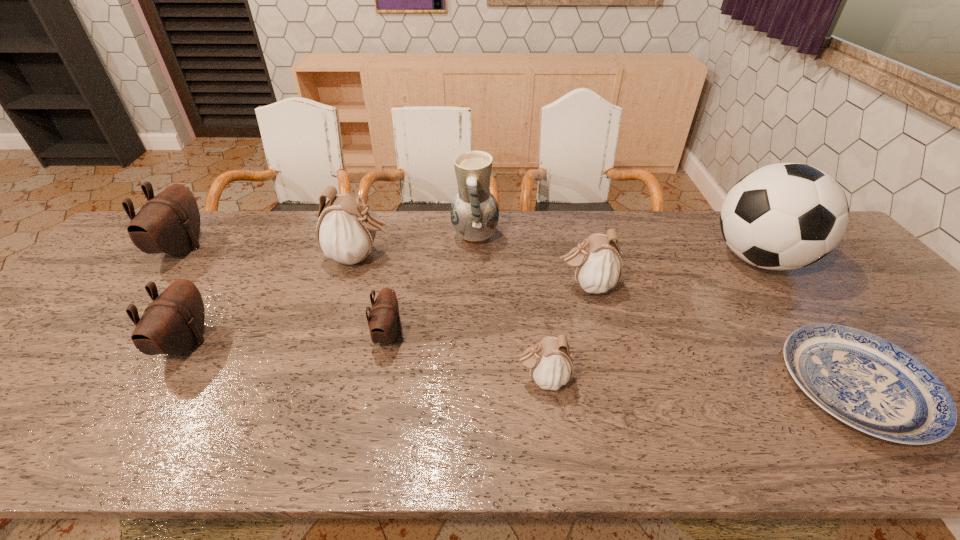
This screenshot has height=540, width=960. Identify the location of vacant space at the far edge of the desktop. (280, 219).

Locate an element on the screen. vacant space at the near edge of the desktop is located at coordinates (452, 419).

You are a GUI agent. You are given a task and a screenshot of the screen. Output one action in this format:
    pyautogui.click(x=<x>, y=<y>)
    Task: Click on the free space at the left edge of the desktop
    The image size is (960, 540).
    Given the screenshot: What is the action you would take?
    pyautogui.click(x=75, y=307)

What are the coordinates of `empty space between the leftmost brown pouch and the smallest brown pouch` in the screenshot? It's located at (285, 292).

Where is `free space that is in between the second white pouch from left to right and the soccer ball`? free space that is in between the second white pouch from left to right and the soccer ball is located at coordinates (651, 319).

This screenshot has width=960, height=540. What are the coordinates of `vacant space that is in between the smallest white pouch and the biggest white pouch` in the screenshot? It's located at (451, 319).

Locate an element on the screen. The image size is (960, 540). vacant region between the second white pouch from right to left and the eighth object from right to left is located at coordinates (364, 361).

Find the location of a particular element. free space between the rightmost white pouch and the biggest white pouch is located at coordinates (473, 272).

Find the location of a particular element. This screenshot has height=540, width=960. free area in between the soccer ball and the rightmost brown pouch is located at coordinates (574, 297).

Identify the location of vacant area between the eighth object from right to left and the soccer ball. This screenshot has height=540, width=960. (472, 301).